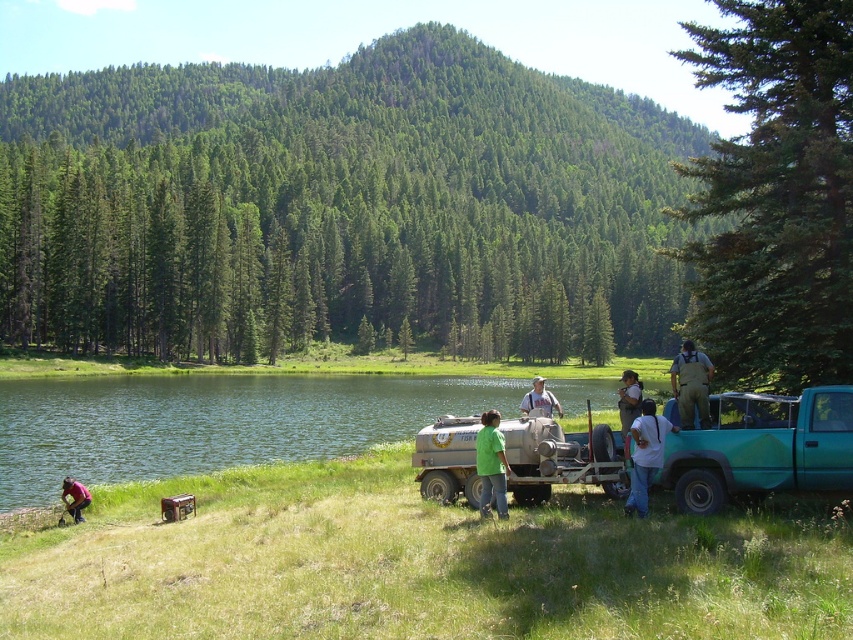
Question: Which of the following is the closest to the observer?

Choices:
 (A) green water at lower left
 (B) green fabric shirt at lower left

Answer: (A)

Question: Among these points, which one is farthest from the camera?

Choices:
 (A) (650, 465)
 (B) (622, 412)
 (C) (479, 452)
 (D) (538, 390)

Answer: (D)

Question: Among these points, which one is farthest from the camera?

Choices:
 (A) (543, 404)
 (B) (682, 342)

Answer: (B)

Question: Does white cotton shirt at lower right come in front of green matte shirt at center?

Choices:
 (A) no
 (B) yes

Answer: (B)

Question: Is camouflage fabric person at center right wider than green matte shirt at center?

Choices:
 (A) yes
 (B) no

Answer: (A)

Question: Considering the relative positions of camouflage fabric person at center right and green matte shirt at center in the image provided, where is camouflage fabric person at center right located with respect to green matte shirt at center?

Choices:
 (A) right
 (B) left

Answer: (A)